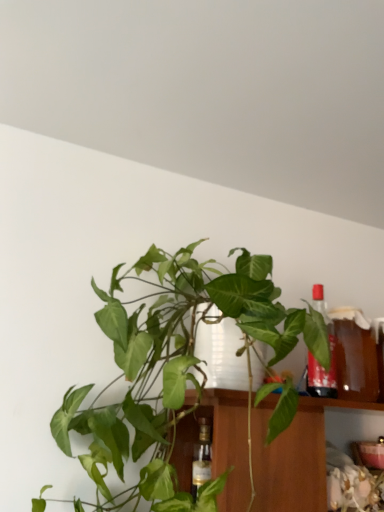
Question: Is green leafy plant at center outside translucent glass bottle at upper right?

Choices:
 (A) yes
 (B) no

Answer: (A)

Question: Could translucent glass bottle at upper right be considered to be inside green leafy plant at center?

Choices:
 (A) yes
 (B) no

Answer: (B)

Question: Is green leafy plant at center at the left side of translucent glass bottle at upper right?

Choices:
 (A) no
 (B) yes

Answer: (B)

Question: Is green leafy plant at center further to the viewer compared to translucent glass bottle at upper right?

Choices:
 (A) no
 (B) yes

Answer: (A)

Question: Are green leafy plant at center and translucent glass bottle at upper right making contact?

Choices:
 (A) no
 (B) yes

Answer: (A)

Question: Does green leafy plant at center have a larger size compared to translucent glass bottle at upper right?

Choices:
 (A) yes
 (B) no

Answer: (A)

Question: Is translucent glass bottle at upper right behind green leafy plant at center?

Choices:
 (A) no
 (B) yes

Answer: (B)

Question: Considering the relative sizes of translucent glass bottle at upper right and green leafy plant at center in the image provided, is translucent glass bottle at upper right taller than green leafy plant at center?

Choices:
 (A) yes
 (B) no

Answer: (B)

Question: Is green leafy plant at center at the back of translucent glass bottle at upper right?

Choices:
 (A) yes
 (B) no

Answer: (B)

Question: Could green leafy plant at center be considered to be inside translucent glass bottle at upper right?

Choices:
 (A) no
 (B) yes

Answer: (A)

Question: Is translucent glass bottle at upper right in contact with green leafy plant at center?

Choices:
 (A) no
 (B) yes

Answer: (A)

Question: Can you confirm if translucent glass bottle at upper right is thinner than green leafy plant at center?

Choices:
 (A) yes
 (B) no

Answer: (A)

Question: Does point (122, 366) appear closer or farther from the camera than point (327, 330)?

Choices:
 (A) farther
 (B) closer

Answer: (B)